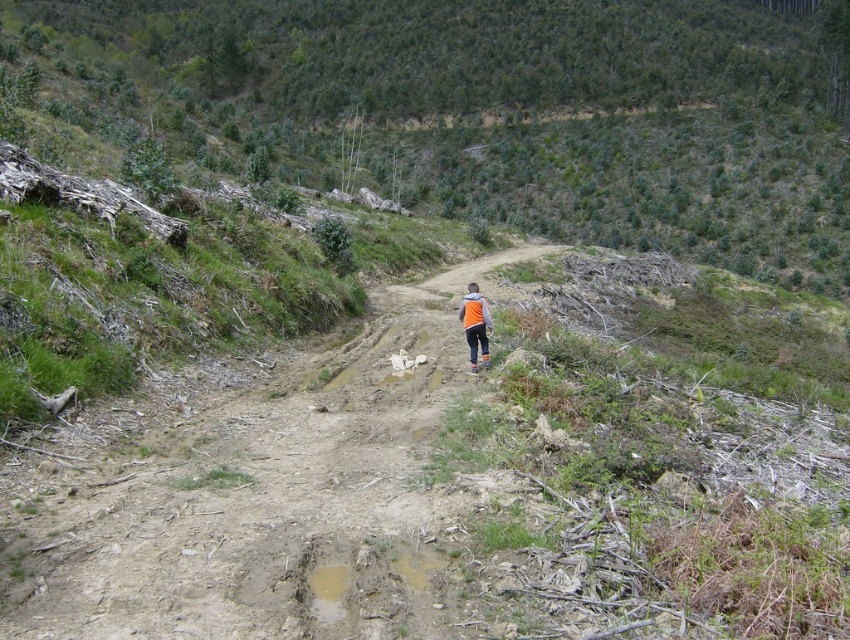
You are a hiker who has just found an orange fleece jacket at center on a rugged outdoor path. There is also a dirt path at center. Which object is closer to you?

The orange fleece jacket at center is closer to you because it is positioned above the dirt path at center.

You are a hiker carrying a backpack and see the dirt path at center and the orange fleece jacket at center. Which object is closer to you?

The dirt path at center is closer to the viewer than the orange fleece jacket at center.

You are a hiker trying to navigate through this forest area. You see a point marked at coordinates (253, 496). What is located at that point?

The point at coordinates (253, 496) marks the location of the dirt path at center.